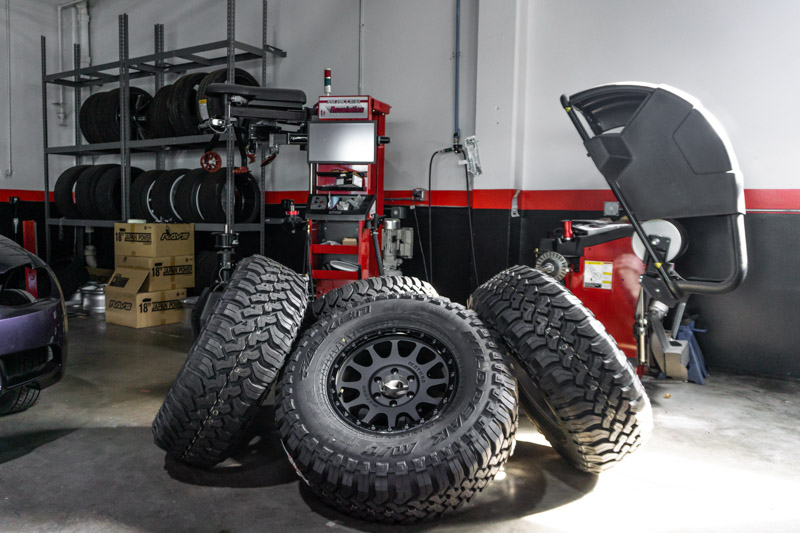
Locate an element on the screen. The image size is (800, 533). shelf is located at coordinates (110, 58).